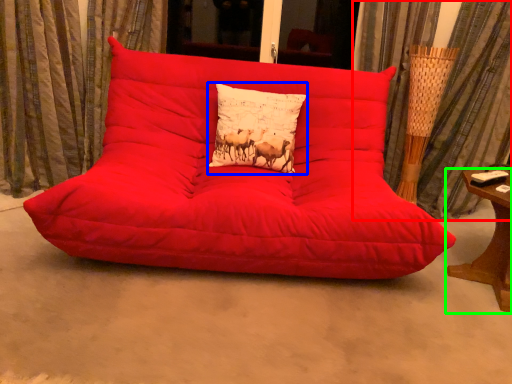
Question: Considering the real-world distances, which object is closest to curtain (highlighted by a red box)? pillow (highlighted by a blue box) or table (highlighted by a green box).

Choices:
 (A) pillow
 (B) table

Answer: (B)